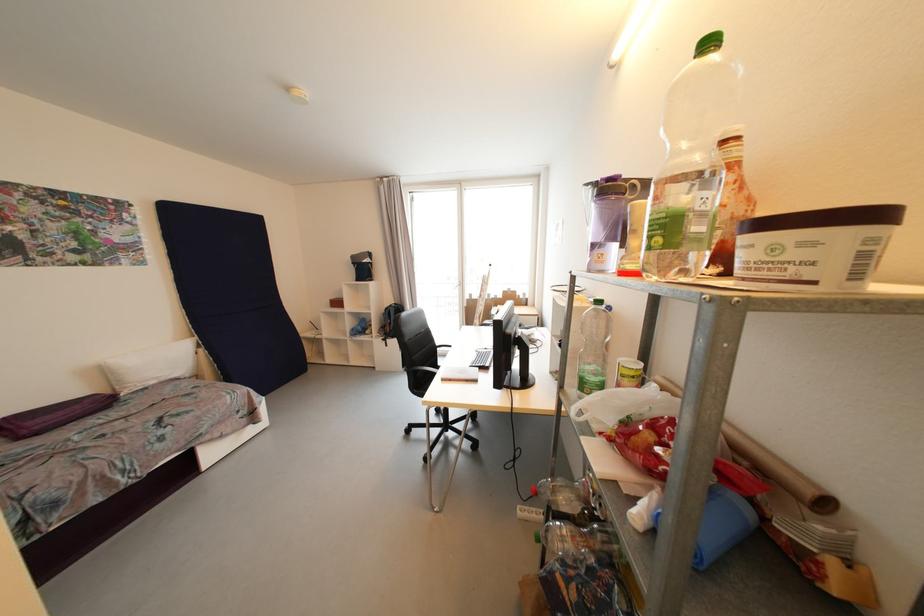
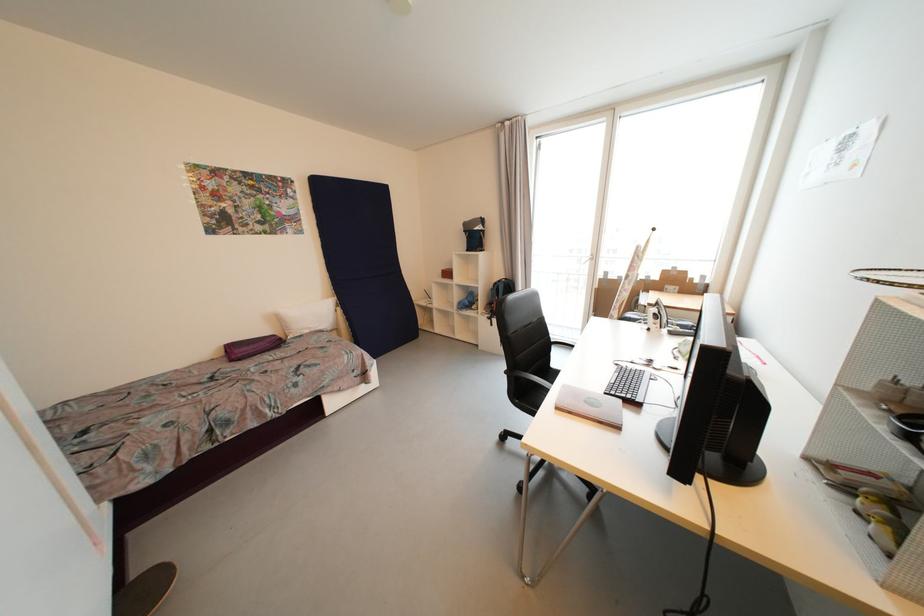
The point at (x=207, y=352) is marked in the first image. Where is the corresponding point in the second image?

(344, 310)